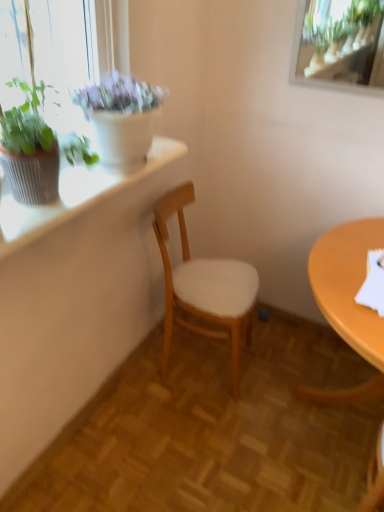
You are a GUI agent. You are given a task and a screenshot of the screen. Output one action in this format:
    pyautogui.click(x=<x>, y=<y>)
    Task: Click on the free point below green leafy plant at upper left, which is counted as the 2th houseplant, starting from the back (from a real-world perspective)
    The image size is (384, 512).
    Given the screenshot: What is the action you would take?
    pyautogui.click(x=53, y=206)